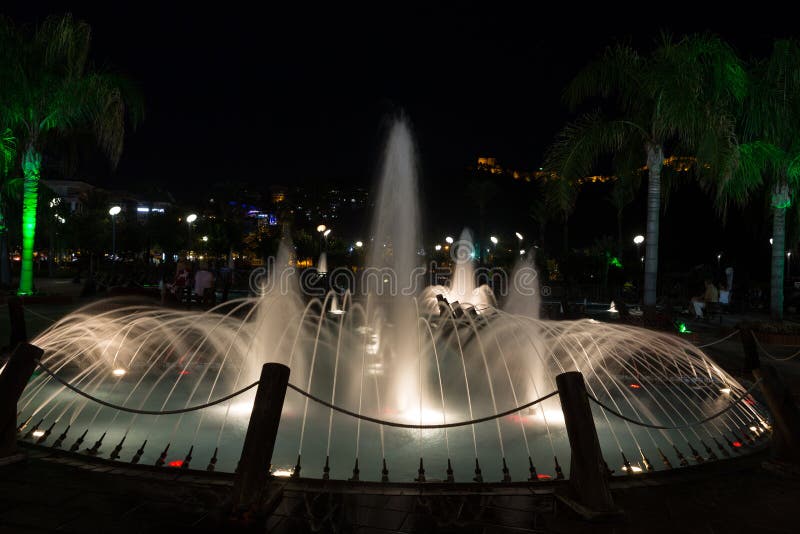
Identify the location of lights. (221, 222).